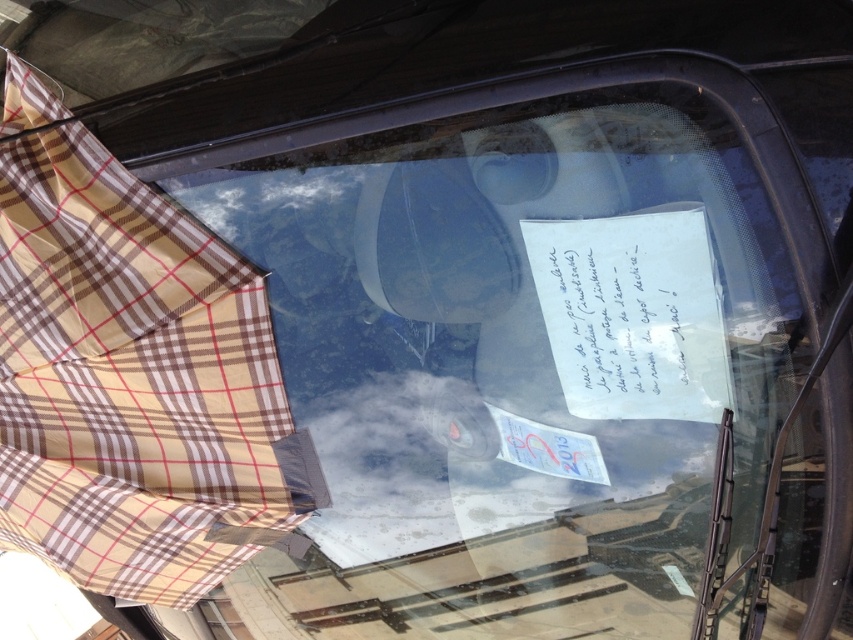
Question: Can you confirm if brown plaid umbrella at left is positioned to the right of white paper at center?

Choices:
 (A) yes
 (B) no

Answer: (B)

Question: Which object appears closest to the camera in this image?

Choices:
 (A) brown plaid umbrella at left
 (B) white paper at center

Answer: (B)

Question: Which of the following is the closest to the observer?

Choices:
 (A) (239, 454)
 (B) (604, 280)

Answer: (B)

Question: Can you confirm if brown plaid umbrella at left is positioned to the left of white paper at center?

Choices:
 (A) yes
 (B) no

Answer: (A)

Question: Does brown plaid umbrella at left have a greater width compared to white paper at center?

Choices:
 (A) yes
 (B) no

Answer: (A)